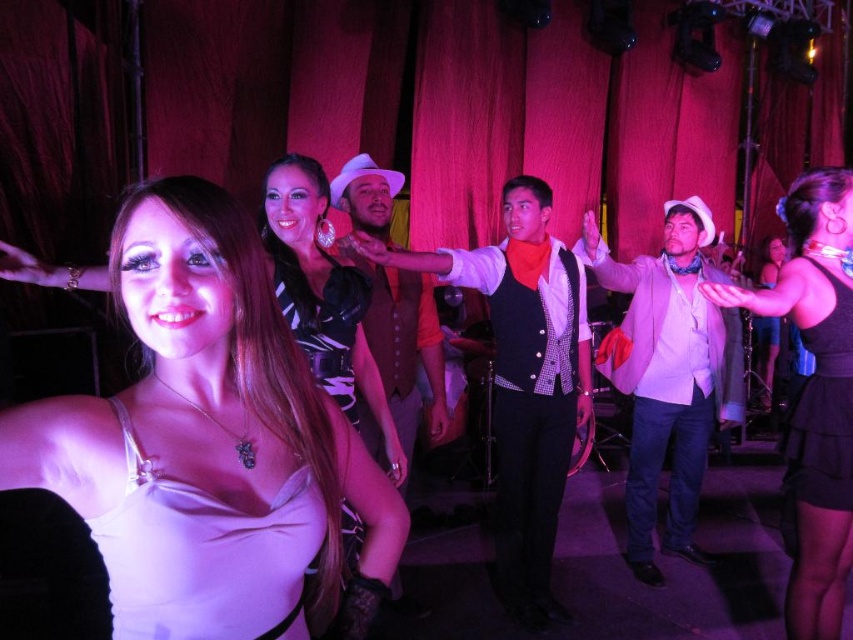
Question: Is matte white dress at center closer to camera compared to satin black dress at center?

Choices:
 (A) no
 (B) yes

Answer: (B)

Question: Which point appears closest to the camera in this image?

Choices:
 (A) (273, 256)
 (B) (126, 403)

Answer: (B)

Question: Which object is the closest to the matte pink vest at center?

Choices:
 (A) matte white dress at center
 (B) shiny purple dress at center
 (C) black satin dress at right

Answer: (B)

Question: Among these points, which one is nearest to the camera?

Choices:
 (A) (109, 577)
 (B) (622, 280)
 (C) (334, 380)

Answer: (A)

Question: Does shiny silver vest at center have a smaller size compared to black satin dress at right?

Choices:
 (A) no
 (B) yes

Answer: (A)

Question: Does leather dress at center have a greater width compared to leather vest at center?

Choices:
 (A) yes
 (B) no

Answer: (B)